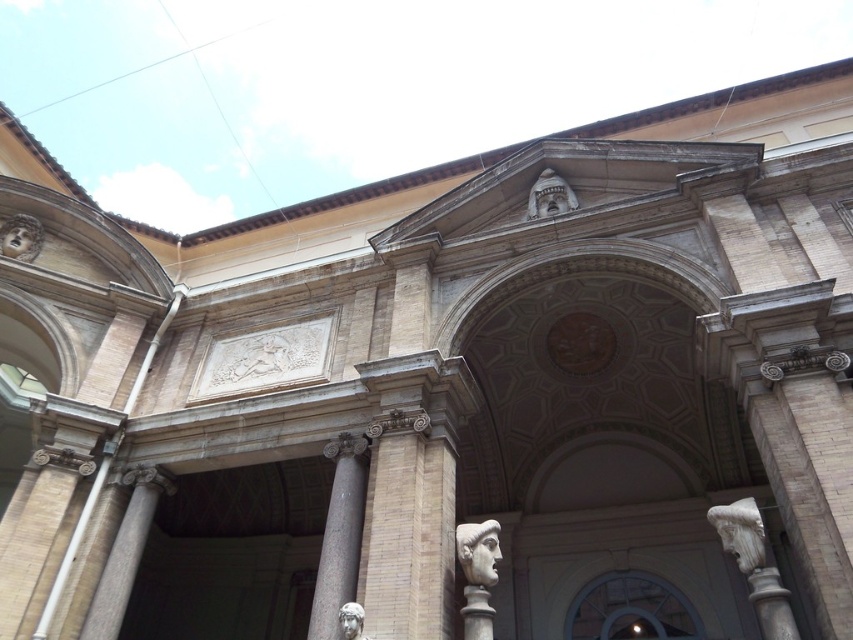
Question: Which object is the farthest from the white marble column at right?

Choices:
 (A) white marble head at center
 (B) white marble statue at lower center
 (C) white stone bust at upper center

Answer: (C)

Question: Which object is farther from the camera taking this photo?

Choices:
 (A) matte stone mask at upper left
 (B) white stone bust at upper center

Answer: (A)

Question: Observing the image, what is the correct spatial positioning of gray stone column at center in reference to white marble head at center?

Choices:
 (A) above
 (B) below

Answer: (A)

Question: Is matte stone archway at center above white marble head at center?

Choices:
 (A) yes
 (B) no

Answer: (B)

Question: Is matte stone mask at upper left smaller than white marble statue at lower center?

Choices:
 (A) yes
 (B) no

Answer: (A)

Question: Which of the following is the farthest from the observer?

Choices:
 (A) (535, 182)
 (B) (318, 628)

Answer: (A)